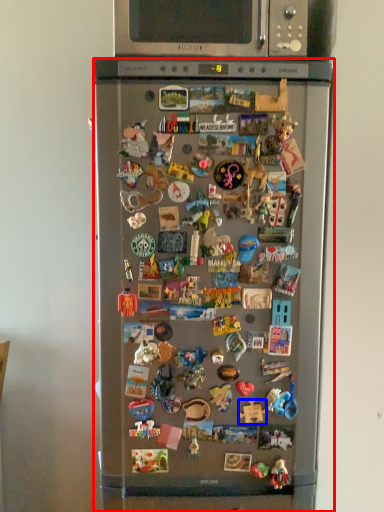
Question: Which of the following is the farthest to the observer, refrigerator (highlighted by a red box) or toy (highlighted by a blue box)?

Choices:
 (A) refrigerator
 (B) toy

Answer: (B)